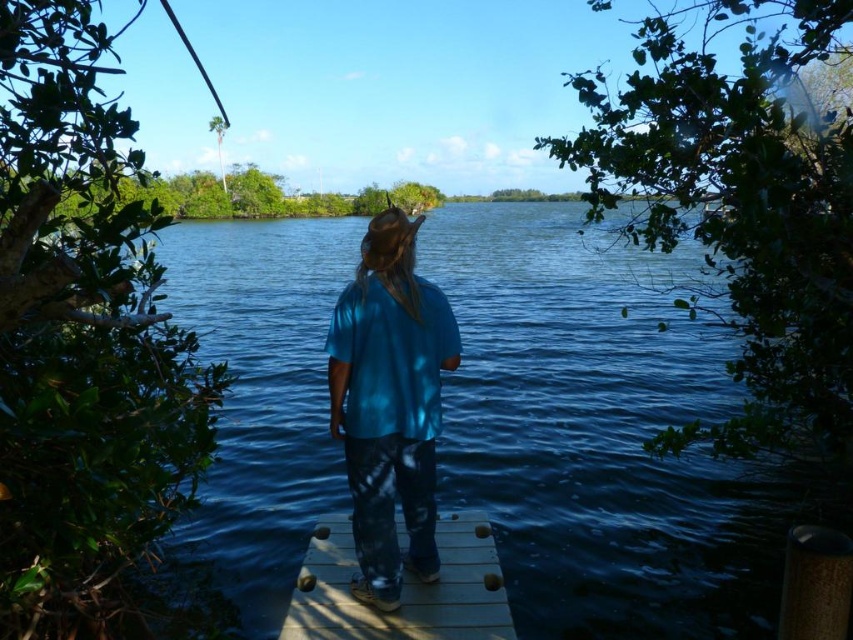
Can you confirm if blue water at center is positioned above blue cotton shirt at center?

Correct, blue water at center is located above blue cotton shirt at center.

Who is more forward, (520, 356) or (361, 477)?

Positioned in front is point (361, 477).

Identify the location of blue water at center. (604, 435).

Between blue cotton shirt at center and wooden at center, which one has less height?

With less height is wooden at center.

Is blue cotton shirt at center below wooden at center?

Actually, blue cotton shirt at center is above wooden at center.

Is point (379, 579) positioned behind point (341, 560)?

No, (379, 579) is in front of (341, 560).

At what (x,y) coordinates should I click in order to perform the action: click on blue cotton shirt at center. Please return your answer as a coordinate pair (x, y). The image size is (853, 640). Looking at the image, I should click on (389, 403).

Is blue water at center above wooden at center?

Yes.

Can you confirm if blue water at center is positioned to the left of wooden at center?

Incorrect, blue water at center is not on the left side of wooden at center.

Find the location of a particular element. This screenshot has width=853, height=640. blue water at center is located at coordinates (604, 435).